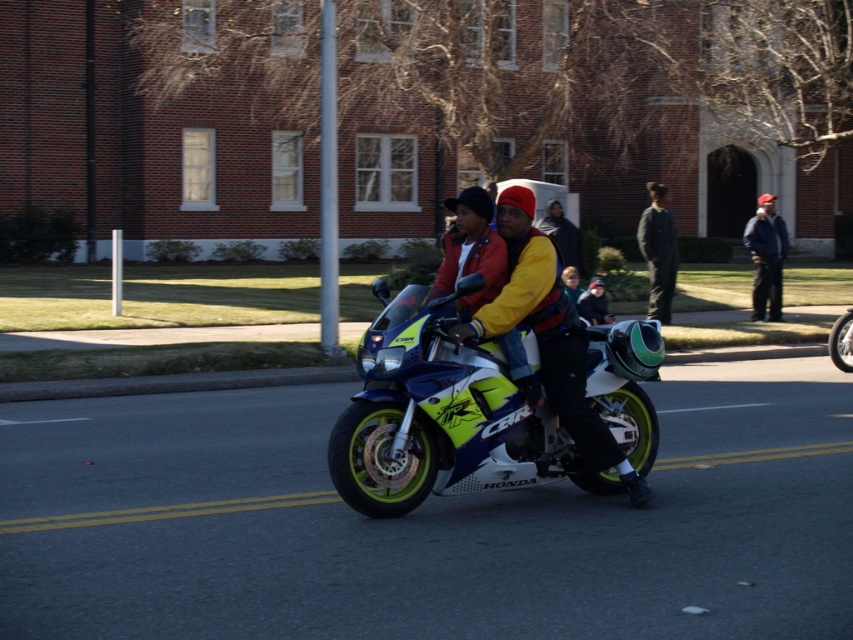
You are standing at the camera position and want to reach the point at coordinates (531, 246). If you can walk 1.5 meters per second, how long will it take you to reach that point?

The distance between the point at coordinates (531, 246) and the camera is 6.92 meters. At a walking speed of 1.5 meters per second, it will take approximately 4.61 seconds to reach the point.

You are a photographer taking a picture of the Honda CBR motorcycle and its rider and passenger. You notice two points marked in the image at coordinates point (450, 461) and point (525, 285). Which of these points is closer to your camera?

Point (525, 285) is closer to the camera because it is less further than point (450, 461).